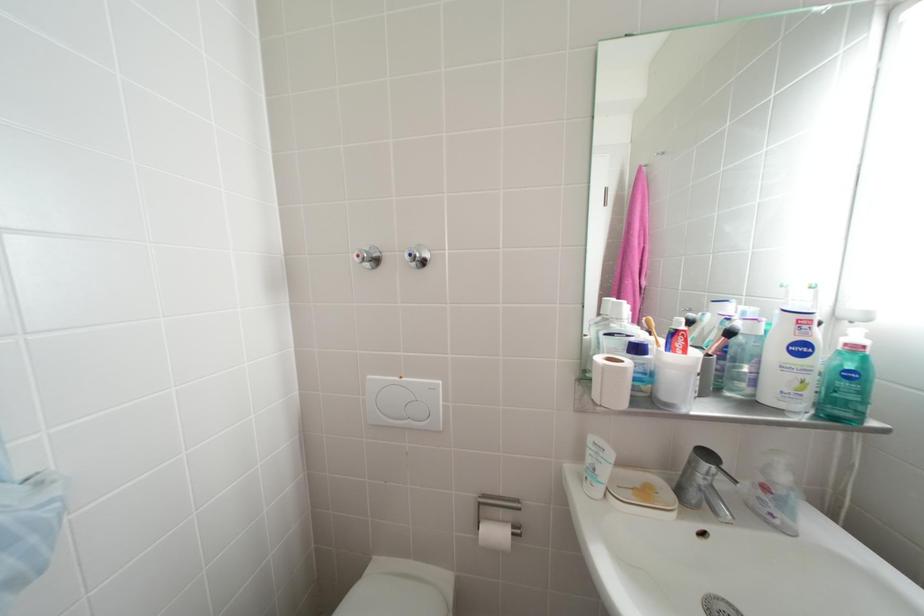
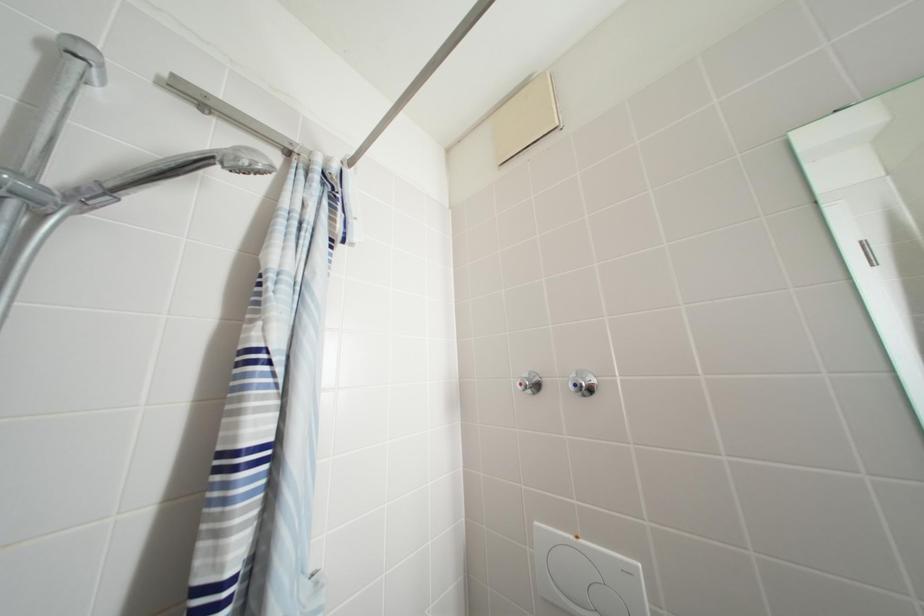
The first image is from the beginning of the video and the second image is from the end. How did the camera likely rotate when shooting the video?

The rotation direction of the camera is left-up.